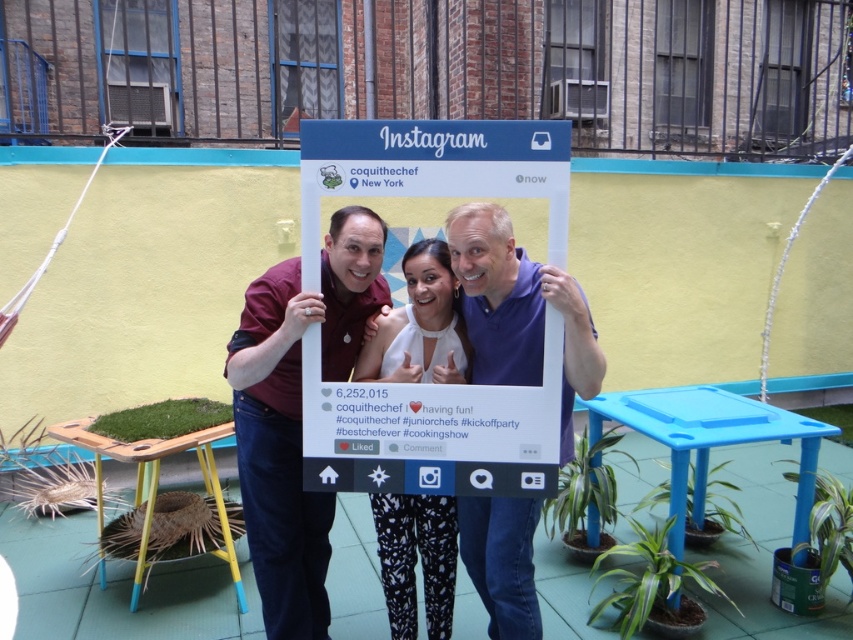
Between white cardboard frame at center and maroon fabric shirt at center, which one has more height?

maroon fabric shirt at center is taller.

Which is more to the left, white cardboard frame at center or maroon fabric shirt at center?

maroon fabric shirt at center

Does point (350, 435) lie in front of point (248, 512)?

Yes, point (350, 435) is closer to viewer.

I want to click on white cardboard frame at center, so [431, 433].

Who is more forward, (563, 388) or (372, 314)?

Point (563, 388) is more forward.

Does purple matte shirt at center have a greater width compared to matte white frame at center?

In fact, purple matte shirt at center might be narrower than matte white frame at center.

This screenshot has height=640, width=853. What do you see at coordinates (519, 310) in the screenshot?
I see `purple matte shirt at center` at bounding box center [519, 310].

Where is `purple matte shirt at center`? The image size is (853, 640). purple matte shirt at center is located at coordinates (519, 310).

Who is positioned more to the left, white cardboard frame at center or purple matte shirt at center?

From the viewer's perspective, white cardboard frame at center appears more on the left side.

Between white cardboard frame at center and purple matte shirt at center, which one has less height?

With less height is white cardboard frame at center.

Which is behind, point (380, 488) or point (515, 252)?

The point (515, 252) is behind.

This screenshot has width=853, height=640. In order to click on white cardboard frame at center in this screenshot , I will do `click(431, 433)`.